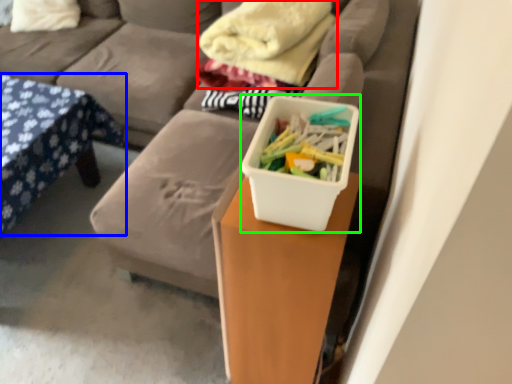
Question: Considering the real-world distances, which object is closest to blanket (highlighted by a red box)? furniture (highlighted by a blue box) or storage box (highlighted by a green box).

Choices:
 (A) furniture
 (B) storage box

Answer: (A)